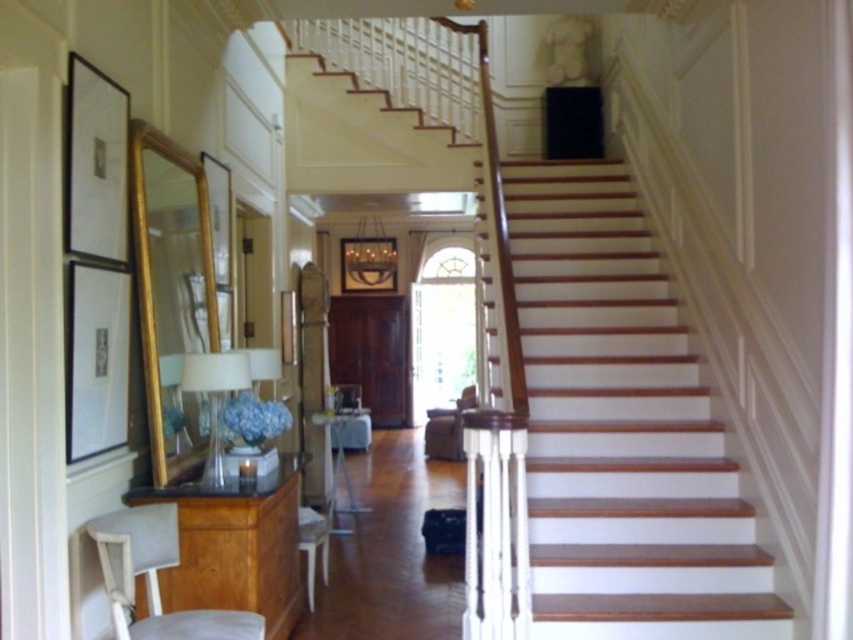
You are standing in the grand staircase area and want to place a small plant between the two points marked as point [167,461] and point [251,628]. Since you can only place the plant at the closer point to you, which point should you choose?

Point [167,461] is further to the viewer than point [251,628], so you should place the plant at point [167,461] because it is closer to you.